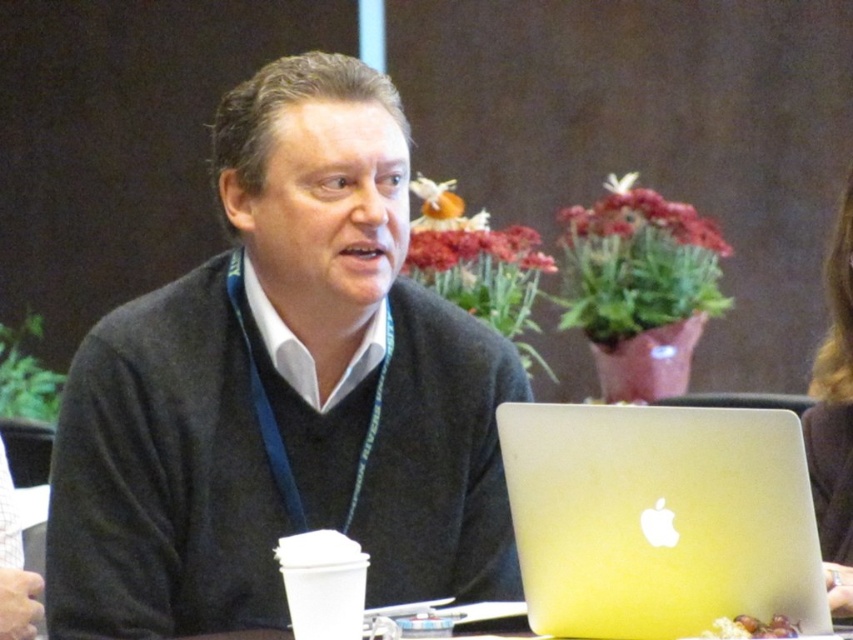
Question: Is dark gray sweater at center above silver metallic laptop at center?

Choices:
 (A) no
 (B) yes

Answer: (B)

Question: Among these objects, which one is nearest to the camera?

Choices:
 (A) dark brown hair at upper right
 (B) dark gray sweater at center
 (C) silver metallic laptop at center

Answer: (C)

Question: Can you confirm if silver metallic laptop at center is bigger than dark brown hair at upper right?

Choices:
 (A) yes
 (B) no

Answer: (B)

Question: Among these objects, which one is nearest to the camera?

Choices:
 (A) dark brown hair at upper right
 (B) dark gray sweater at center

Answer: (A)

Question: Which object appears closest to the camera in this image?

Choices:
 (A) dark gray sweater at center
 (B) dark brown hair at upper right

Answer: (B)

Question: Is dark gray sweater at center smaller than silver metallic laptop at center?

Choices:
 (A) no
 (B) yes

Answer: (A)